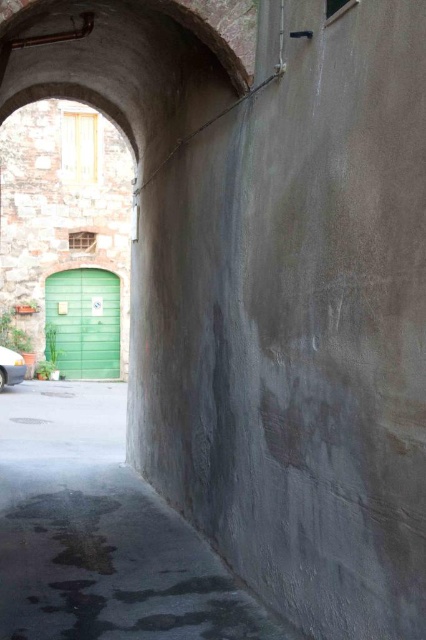
You are standing in the alleyway and want to reach the green door. There is a puddle at point (89,324). If you walk straight towards the green door, will you step into the puddle?

The distance between you and the puddle at point (89,324) is 62.87 feet. Since you are walking straight towards the green door, you will pass by the puddle at point (89,324), but the puddle is 62.87 feet away from you, so you will not step into it unless you intentionally move towards it.

Consider the image. You are standing at the entrance of the alleyway and want to reach the green wooden door at left. Based on the coordinates provided, in which direction should you move relative to the alleyway?

The green wooden door at left is located at coordinates 0.505 on the x axis and 0.195 on the y axis. Since you are at the entrance, you should move forward along the alleyway towards the green wooden door at left.